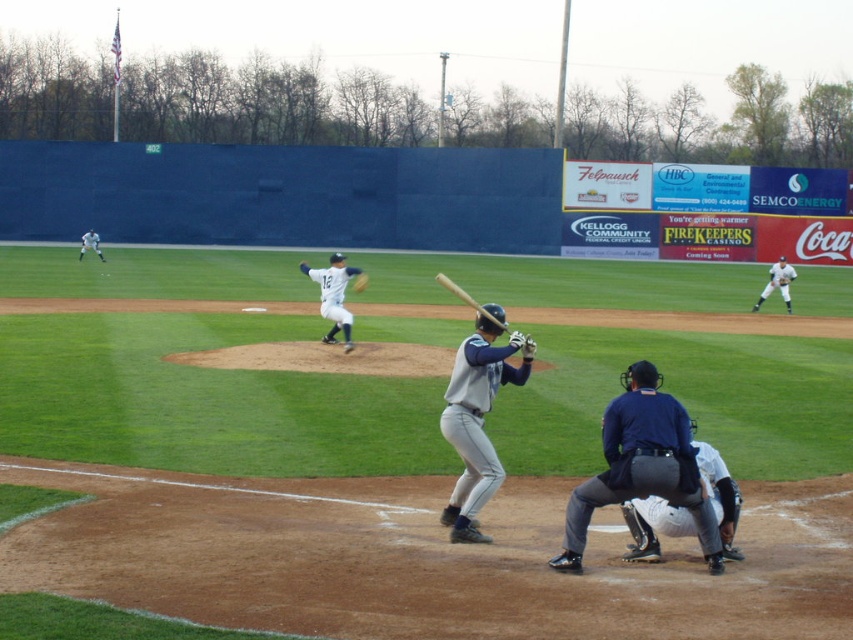
Does gray fabric catcher at lower center have a smaller size compared to wooden baseball bat at center?

Yes.

Locate an element on the screen. gray fabric catcher at lower center is located at coordinates (653, 525).

What do you see at coordinates (641, 467) in the screenshot?
I see `black leather umpire at lower center` at bounding box center [641, 467].

Does point (683, 452) come behind point (453, 438)?

No, (683, 452) is in front of (453, 438).

Identify the location of black leather umpire at lower center. (641, 467).

Is gray matte baseball bat at center below white uniform at right?

Yes, gray matte baseball bat at center is below white uniform at right.

This screenshot has width=853, height=640. Describe the element at coordinates (477, 417) in the screenshot. I see `gray matte baseball bat at center` at that location.

What are the coordinates of `gray matte baseball bat at center` in the screenshot? It's located at (477, 417).